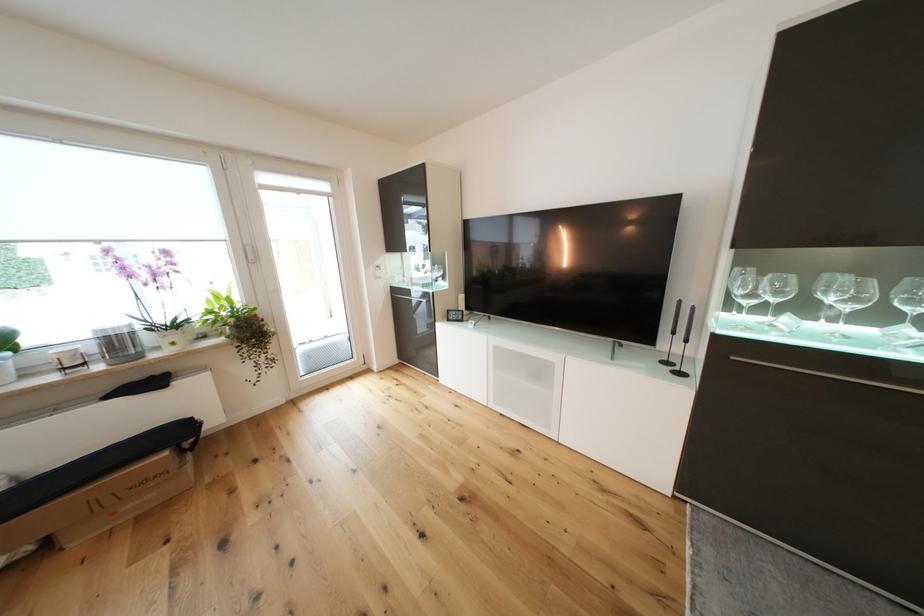
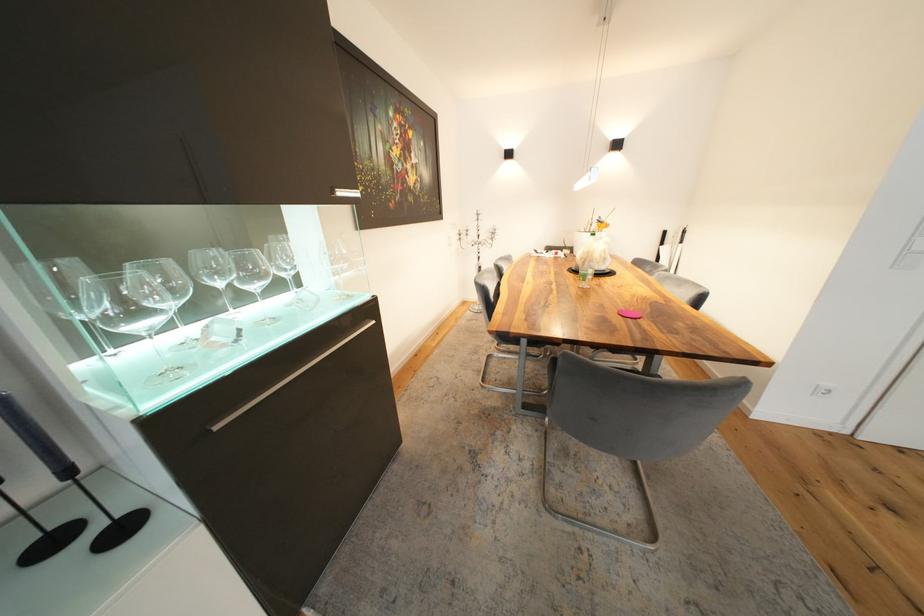
Find the pixel in the second image that matches point 674,365 in the first image.

(59, 545)